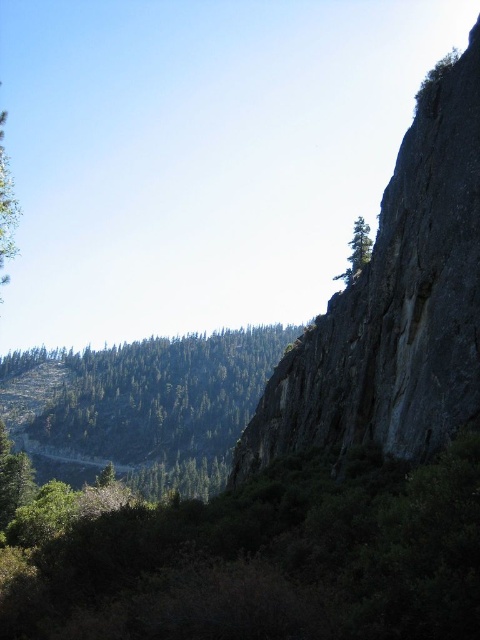
You are an environmental scientist assessing the landscape. Based on the image, which object, the dark gray rock at right or the green textured trees at center, is shorter?

The dark gray rock at right is shorter than the green textured trees at center.

You are an environmental scientist examining this landscape. You notice the green leafy tree at left and the green matte tree at upper center. Which of these two trees is positioned higher up in the image?

The green leafy tree at left is positioned higher up in the image than the green matte tree at upper center.

You are standing at the base of the cliff and see two points marked in the scene. The first point is at coordinates point (19, 212) and the second is at point (368, 241). Which point is closer to you?

Point (368, 241) is closer to you because it is in front of point (19, 212).